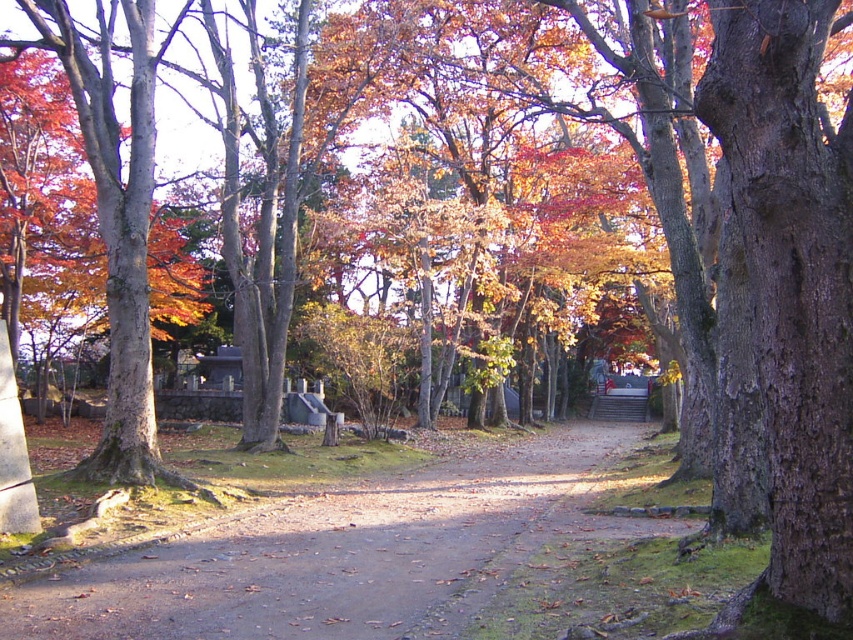
You are a hiker walking along the dirt path at center and want to take a photo of the smooth bark tree at left. Which direction should you face to capture the tree in your shot?

The dirt path at center is positioned on the right side of smooth bark tree at left, so you should face to the left to capture the smooth bark tree at left in your shot.

You are standing at the start of the dirt path at center and want to walk towards the smooth bark tree at left. Which direction should you head to reach the tree?

The smooth bark tree at left is located to the left of the dirt path at center. To reach it, you should walk towards the left side of the path.